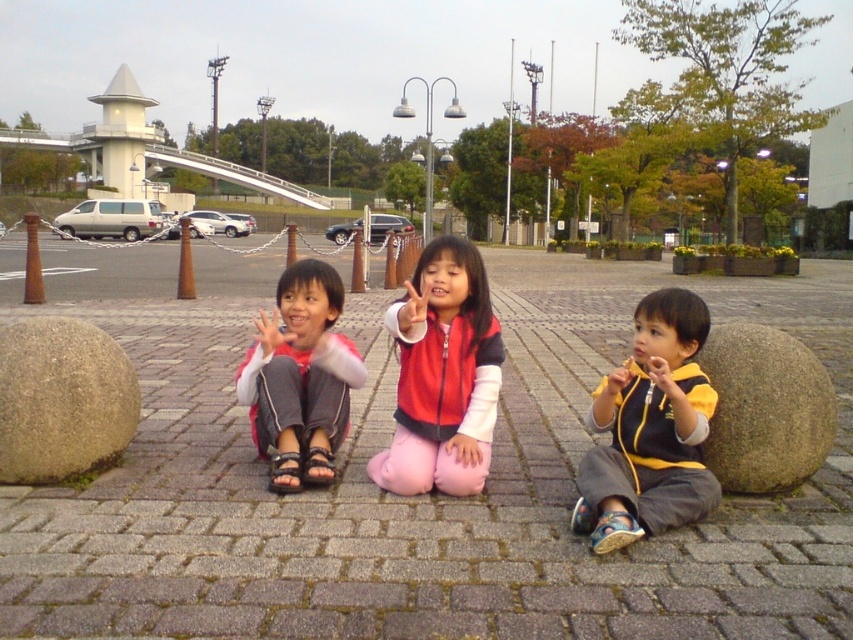
Question: Observing the image, what is the correct spatial positioning of brick pavement at center in reference to yellow fabric shirt at center?

Choices:
 (A) above
 (B) below

Answer: (A)

Question: Which of the following is the closest to the observer?

Choices:
 (A) brown rough stone at left
 (B) matte red vest at center
 (C) yellow fabric shirt at center
 (D) green stone boulder at lower right

Answer: (C)

Question: Can you confirm if matte red vest at center is positioned above green stone boulder at lower right?

Choices:
 (A) yes
 (B) no

Answer: (A)

Question: Among these objects, which one is nearest to the camera?

Choices:
 (A) yellow fabric shirt at center
 (B) pink fabric pants at center
 (C) brown rough stone at left
 (D) brick pavement at center

Answer: (D)

Question: Is yellow fabric shirt at center wider than pink fabric pants at center?

Choices:
 (A) no
 (B) yes

Answer: (A)

Question: Which object appears closest to the camera in this image?

Choices:
 (A) brown rough stone at left
 (B) matte red vest at center
 (C) pink fabric pants at center
 (D) green stone boulder at lower right

Answer: (B)